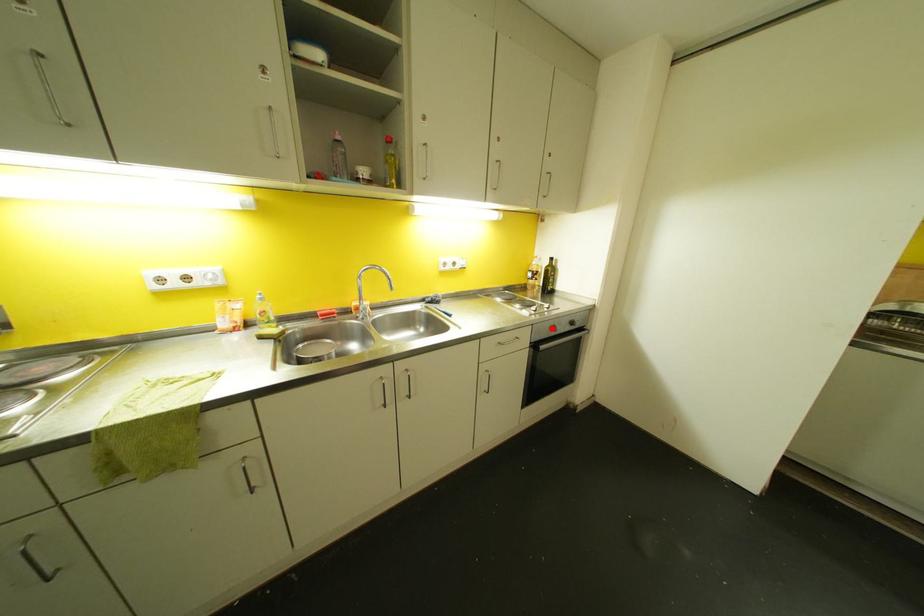
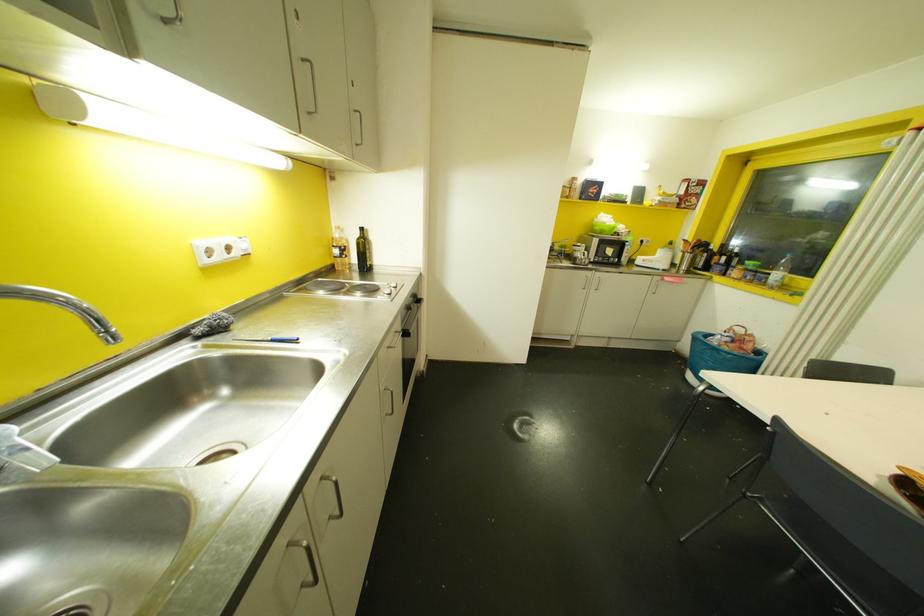
Question: I am providing you with two images of the same scene from different viewpoints. A red point is shown in image1. For the corresponding object point in image2, is it positioned nearer or farther from the camera?

Choices:
 (A) Nearer
 (B) Farther

Answer: (A)